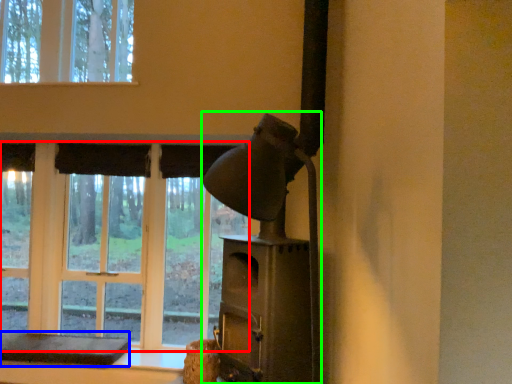
Question: Which object is positioned farthest from bay window (highlighted by a red box)? Select from furniture (highlighted by a blue box) and fireplace (highlighted by a green box).

Choices:
 (A) furniture
 (B) fireplace

Answer: (B)